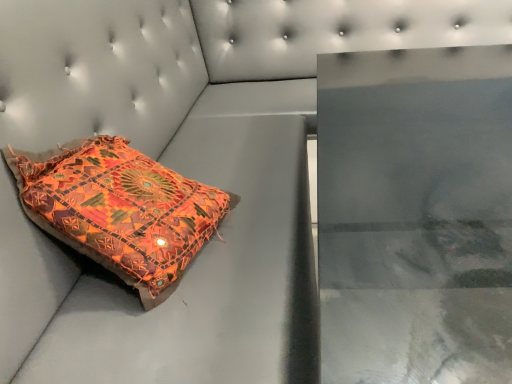
This screenshot has width=512, height=384. What do you see at coordinates (416, 215) in the screenshot?
I see `transparent glass table at upper right` at bounding box center [416, 215].

Identify the location of transparent glass table at upper right. Image resolution: width=512 pixels, height=384 pixels. (416, 215).

Where is `transparent glass table at upper right`? transparent glass table at upper right is located at coordinates (416, 215).